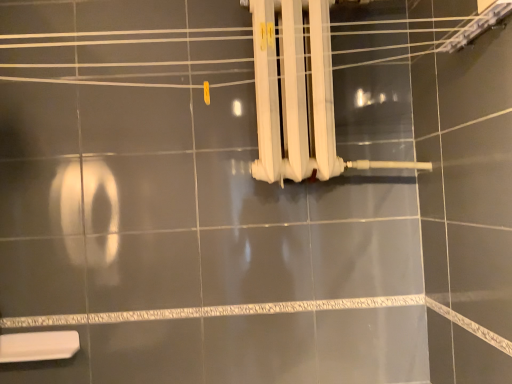
Question: Is white plastic toilet at lower left wider or thinner than white plastic radiator at upper right?

Choices:
 (A) wide
 (B) thin

Answer: (B)

Question: Is point (32, 334) positioned closer to the camera than point (288, 178)?

Choices:
 (A) closer
 (B) farther

Answer: (B)

Question: From a real-world perspective, is white plastic toilet at lower left physically located above or below white plastic radiator at upper right?

Choices:
 (A) above
 (B) below

Answer: (B)

Question: Considering their positions, is white plastic radiator at upper right located in front of or behind white plastic toilet at lower left?

Choices:
 (A) behind
 (B) front

Answer: (B)

Question: From a real-world perspective, is white plastic radiator at upper right positioned above or below white plastic toilet at lower left?

Choices:
 (A) above
 (B) below

Answer: (A)

Question: From the image's perspective, relative to white plastic toilet at lower left, is white plastic radiator at upper right above or below?

Choices:
 (A) above
 (B) below

Answer: (A)

Question: Is white plastic radiator at upper right to the left or to the right of white plastic toilet at lower left in the image?

Choices:
 (A) right
 (B) left

Answer: (A)